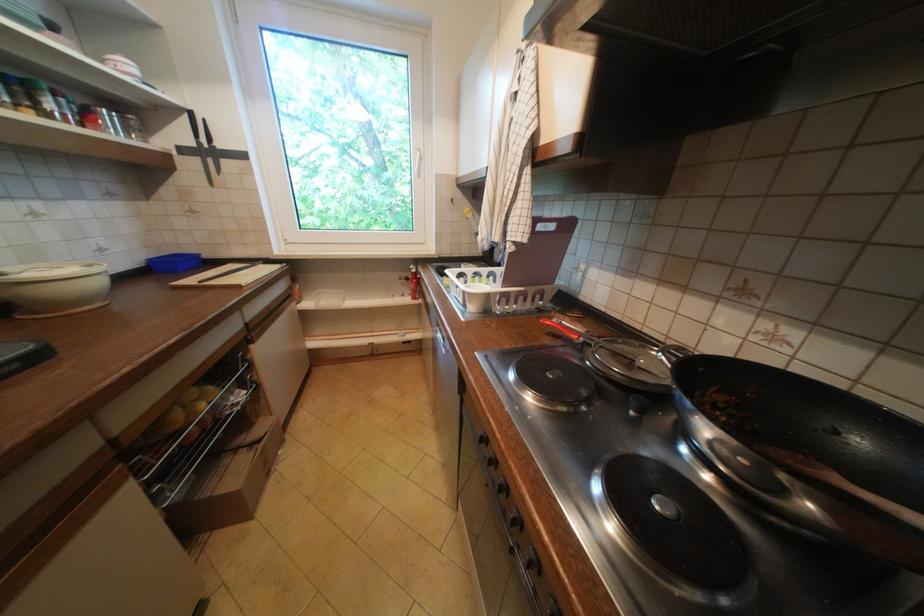
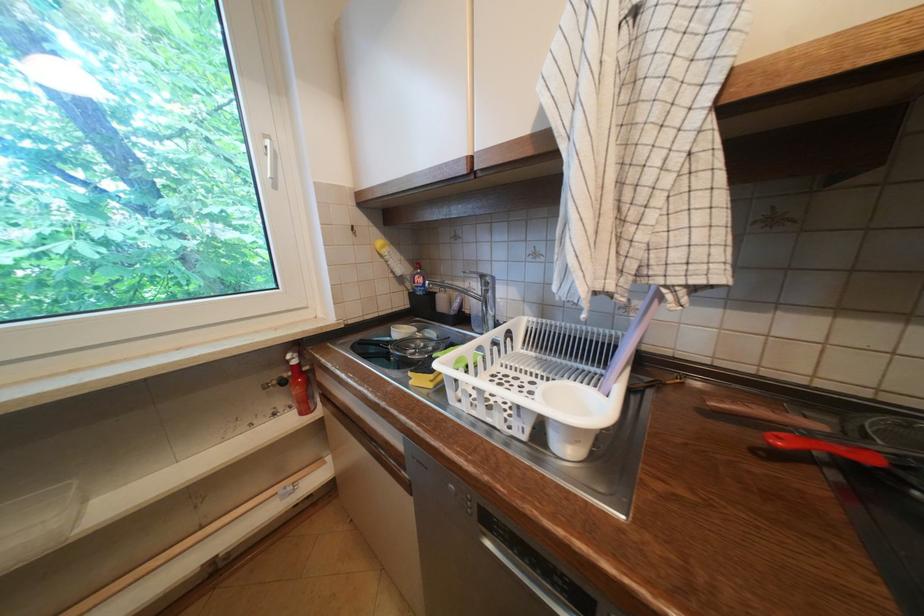
Find the pixel in the second image that matches point 419,270 in the first image.

(296, 362)